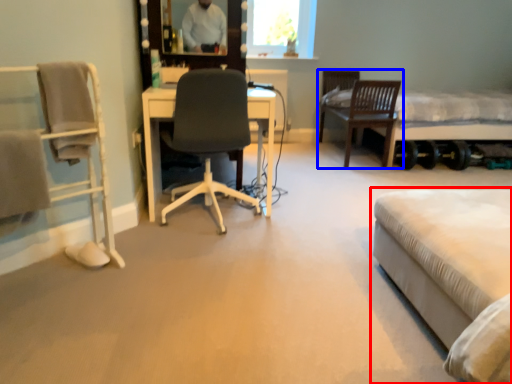
Question: Which of the following is the farthest to the observer, bed (highlighted by a red box) or chair (highlighted by a blue box)?

Choices:
 (A) bed
 (B) chair

Answer: (B)